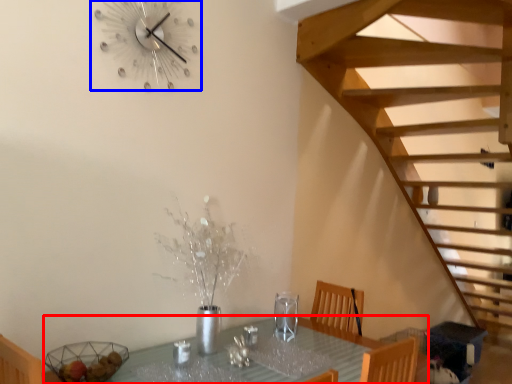
Question: Which object appears farthest to the camera in this image, table (highlighted by a red box) or wall clock (highlighted by a blue box)?

Choices:
 (A) table
 (B) wall clock

Answer: (B)